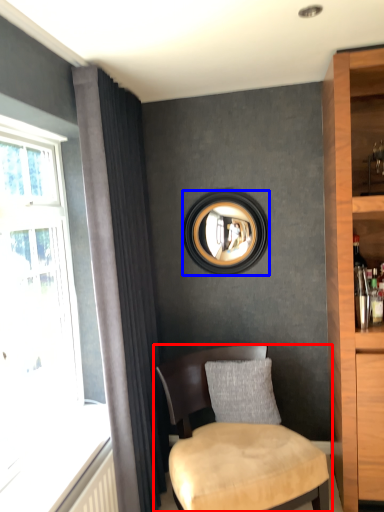
Question: Which of the following is the farthest to the observer, chair (highlighted by a red box) or picture frame (highlighted by a blue box)?

Choices:
 (A) chair
 (B) picture frame

Answer: (B)